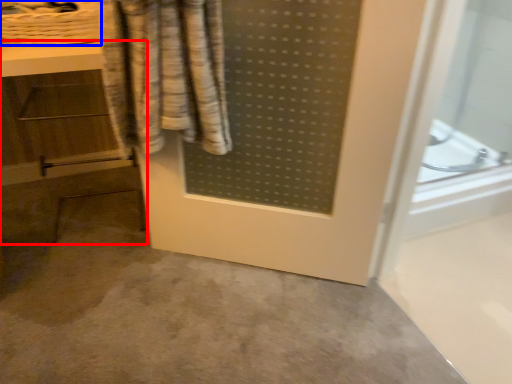
Question: Which object appears closest to the camera in this image, vanity (highlighted by a red box) or basket (highlighted by a blue box)?

Choices:
 (A) vanity
 (B) basket

Answer: (A)